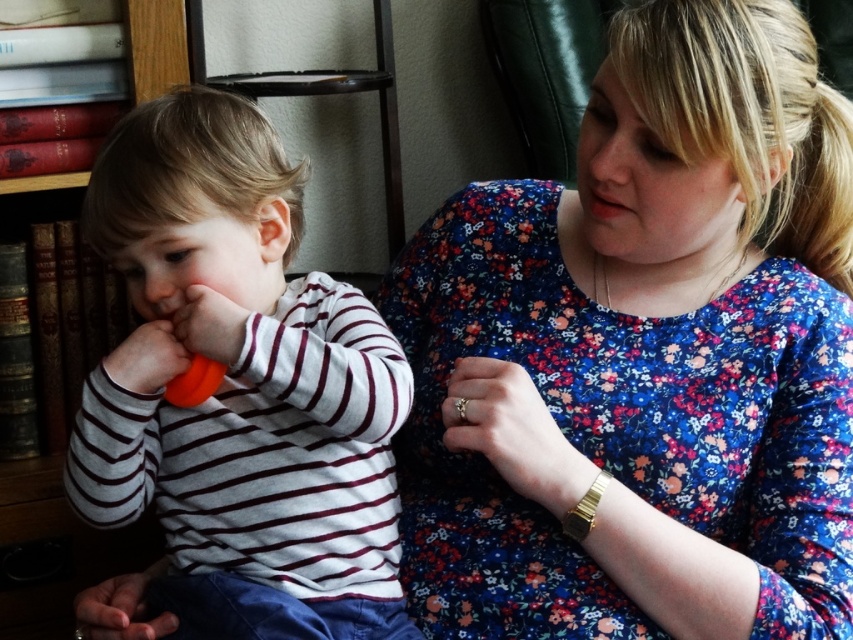
You are a parent trying to store the orange rubber teether at left and the red leather bookshelf at left in a storage box. Which object requires a wider storage box?

The orange rubber teether at left might require a wider storage box than the red leather bookshelf at left because it might be wider according to the description.

The adult is wearing a blue floral dress at center and the child is holding an orange rubber teether at left. Which object is bigger?

The blue floral dress at center is larger in size than the orange rubber teether at left.